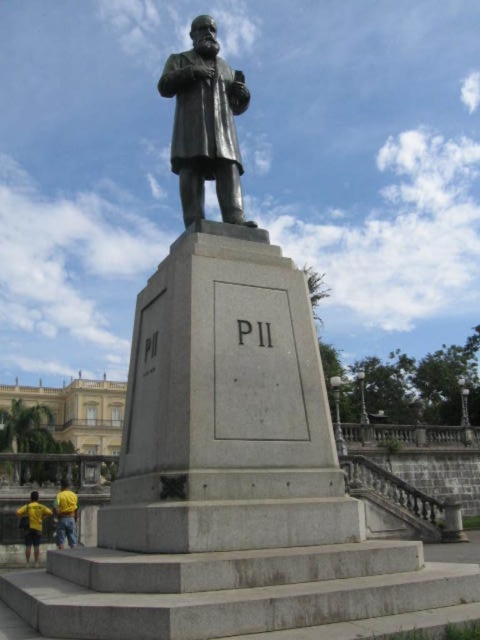
Question: Which point is closer to the camera?

Choices:
 (A) (39, 525)
 (B) (57, 513)
 (C) (187, 90)

Answer: (C)

Question: Does yellow shirt at lower left appear on the left side of yellow fabric at lower left?

Choices:
 (A) no
 (B) yes

Answer: (B)

Question: From the image, what is the correct spatial relationship of yellow shirt at lower left in relation to yellow fabric at lower left?

Choices:
 (A) below
 (B) above

Answer: (A)

Question: Which of these objects is positioned farthest from the bronze statue at center?

Choices:
 (A) yellow shirt at lower left
 (B) yellow fabric at lower left

Answer: (A)

Question: Which point is closer to the camera?

Choices:
 (A) (201, 200)
 (B) (26, 538)

Answer: (A)

Question: Is yellow shirt at lower left positioned before yellow fabric at lower left?

Choices:
 (A) yes
 (B) no

Answer: (B)